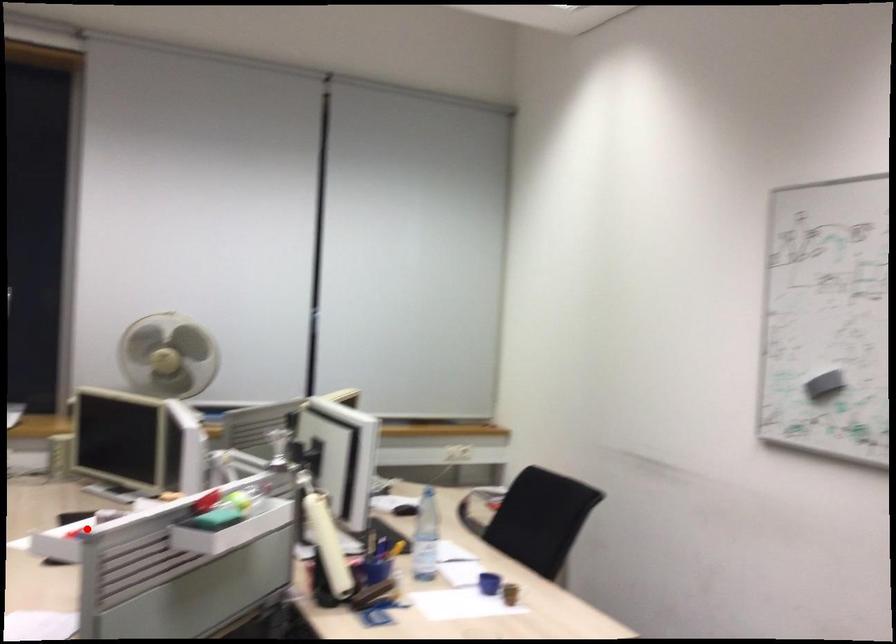
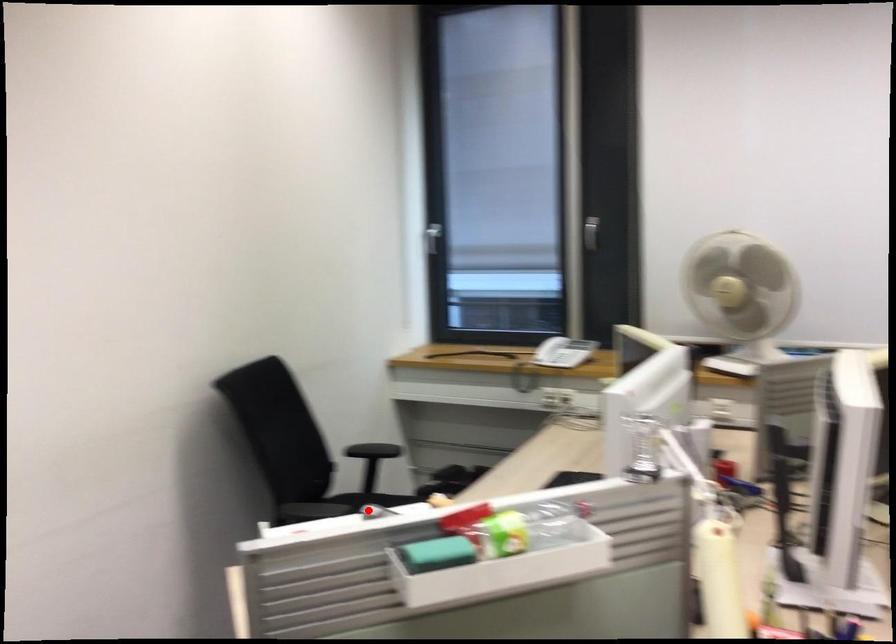
I am providing you with two images of the same scene from different viewpoints. A red point is marked on the first image and another point is marked on the second image. Is the marked point in image1 the same physical position as the marked point in image2?

Yes